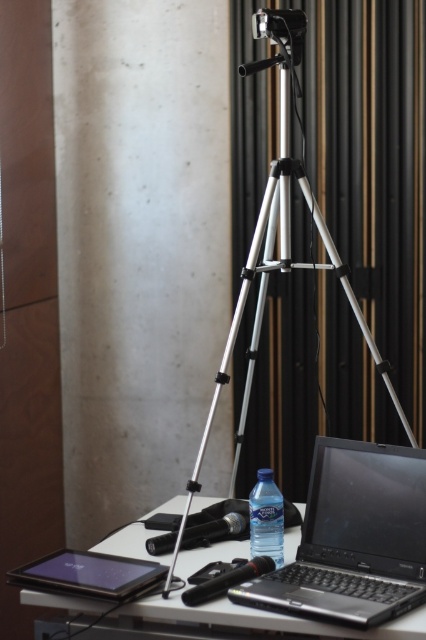
Question: Does black plastic laptop at center appear under silver metallic tripod at center?

Choices:
 (A) yes
 (B) no

Answer: (A)

Question: In this image, where is black plastic laptop at center located relative to clear plastic bottle at center?

Choices:
 (A) above
 (B) below

Answer: (B)

Question: Which object is farther from the camera taking this photo?

Choices:
 (A) white plastic table at center
 (B) black plastic laptop at center
 (C) clear plastic bottle at center

Answer: (C)

Question: Does white plastic table at center have a larger size compared to clear plastic bottle at center?

Choices:
 (A) yes
 (B) no

Answer: (A)

Question: Which of these objects is positioned farthest from the clear plastic bottle at center?

Choices:
 (A) silver metallic tripod at center
 (B) black plastic laptop at center

Answer: (A)

Question: Which of the following is the closest to the observer?

Choices:
 (A) white plastic table at center
 (B) clear plastic bottle at center
 (C) silver metallic tripod at center

Answer: (A)